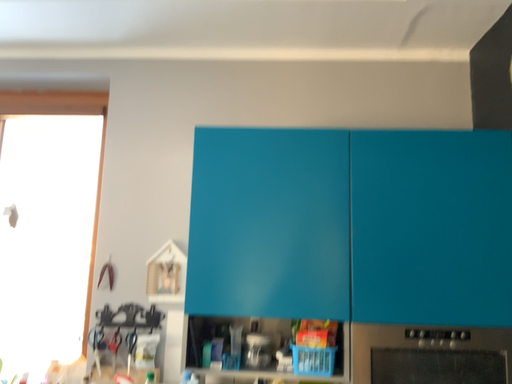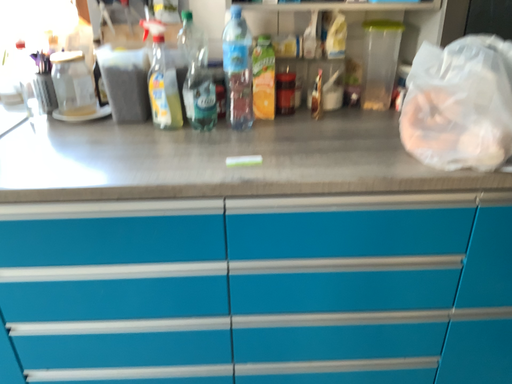
Question: Which way did the camera rotate in the video?

Choices:
 (A) rotated downward
 (B) rotated upward

Answer: (A)